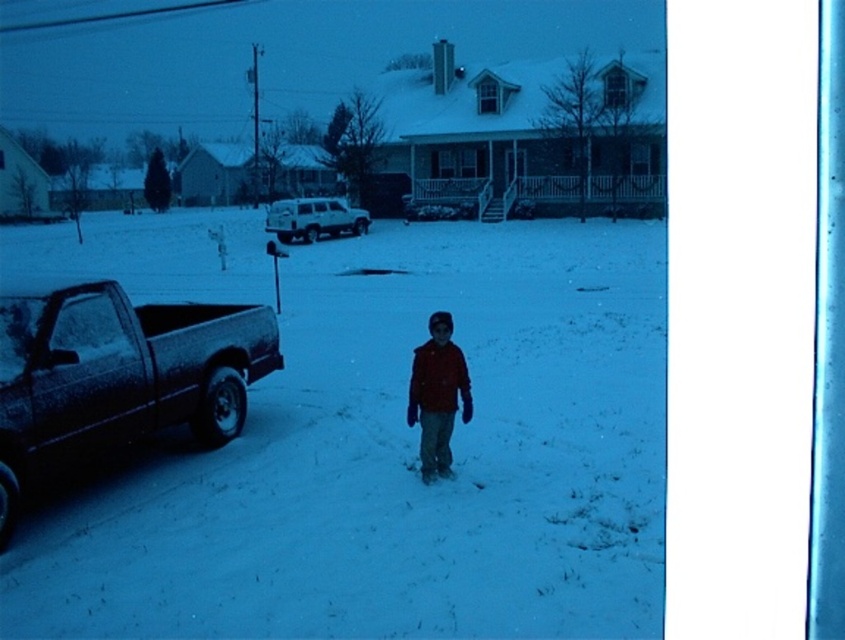
What do you see at coordinates (396, 460) in the screenshot? This screenshot has height=640, width=845. I see `slightly glossy snow at center` at bounding box center [396, 460].

Who is positioned more to the right, slightly glossy snow at center or satin black pickup truck at lower left?

Positioned to the right is slightly glossy snow at center.

Describe the element at coordinates (396, 460) in the screenshot. I see `slightly glossy snow at center` at that location.

You are a GUI agent. You are given a task and a screenshot of the screen. Output one action in this format:
    pyautogui.click(x=<x>, y=<y>)
    Task: Click on the slightly glossy snow at center
    Image resolution: width=845 pixels, height=640 pixels.
    Given the screenshot: What is the action you would take?
    pyautogui.click(x=396, y=460)

Is satin black pickup truck at lower left to the right of matte red jacket at center from the viewer's perspective?

No, satin black pickup truck at lower left is not to the right of matte red jacket at center.

Can you confirm if satin black pickup truck at lower left is smaller than matte red jacket at center?

Actually, satin black pickup truck at lower left might be larger than matte red jacket at center.

Where is `satin black pickup truck at lower left`? The image size is (845, 640). satin black pickup truck at lower left is located at coordinates (116, 374).

Measure the distance from slightly glossy snow at center to white matte suv at center.

slightly glossy snow at center is 45.95 feet from white matte suv at center.

Who is higher up, slightly glossy snow at center or white matte suv at center?

Positioned higher is white matte suv at center.

Consider the image. Who is more distant from viewer, (x=232, y=273) or (x=319, y=214)?

Point (x=319, y=214)

Find the location of `slightly glossy snow at center`. slightly glossy snow at center is located at coordinates (396, 460).